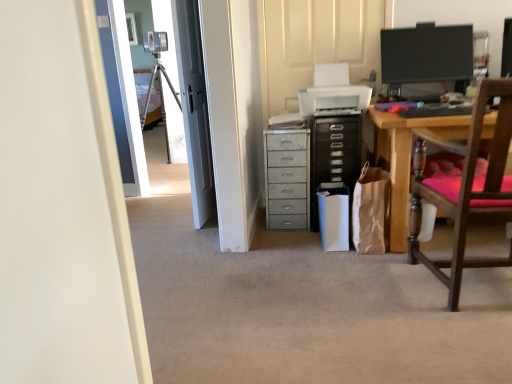
Identify the location of wooden chair with pink cushion at right. This screenshot has width=512, height=384. (465, 188).

Image resolution: width=512 pixels, height=384 pixels. Describe the element at coordinates (370, 210) in the screenshot. I see `brown paper bag at lower right` at that location.

Locate an element on the screen. black glossy monitor at upper right is located at coordinates (425, 59).

Considering the relative positions of wooden chair with pink cushion at right and metallic gray chest of drawers at center in the image provided, is wooden chair with pink cushion at right to the left or to the right of metallic gray chest of drawers at center?

wooden chair with pink cushion at right is to the right of metallic gray chest of drawers at center.

Do you think wooden chair with pink cushion at right is within metallic gray chest of drawers at center, or outside of it?

wooden chair with pink cushion at right exists outside the volume of metallic gray chest of drawers at center.

Which is in front, wooden chair with pink cushion at right or metallic gray chest of drawers at center?

wooden chair with pink cushion at right is in front.

From a real-world perspective, is wooden chair with pink cushion at right positioned under metallic gray chest of drawers at center based on gravity?

Actually, wooden chair with pink cushion at right is physically above metallic gray chest of drawers at center in the real world.

How many degrees apart are the facing directions of wooden chair with pink cushion at right and black glossy monitor at upper right?

They differ by 176 degrees in their facing directions.

Can we say wooden chair with pink cushion at right lies outside black glossy monitor at upper right?

Yes.

From the image's perspective, relative to black glossy monitor at upper right, is wooden chair with pink cushion at right above or below?

Based on their image positions, wooden chair with pink cushion at right is located beneath black glossy monitor at upper right.

Where is `chair located below the black glossy monitor at upper right (from the image's perspective)`? This screenshot has height=384, width=512. chair located below the black glossy monitor at upper right (from the image's perspective) is located at coordinates [465, 188].

Who is taller, black glossy monitor at upper right or brown paper bag at lower right?

Standing taller between the two is black glossy monitor at upper right.

In the scene shown: Considering the relative sizes of black glossy monitor at upper right and brown paper bag at lower right in the image provided, is black glossy monitor at upper right bigger than brown paper bag at lower right?

Correct, black glossy monitor at upper right is larger in size than brown paper bag at lower right.

At what (x,y) coordinates should I click in order to perform the action: click on computer monitor above the brown paper bag at lower right (from a real-world perspective). Please return your answer as a coordinate pair (x, y). This screenshot has width=512, height=384. Looking at the image, I should click on (425, 59).

Measure the distance from brown paper bag at lower right to metallic gray chest of drawers at center.

brown paper bag at lower right is 17.05 inches away from metallic gray chest of drawers at center.

Would you say metallic gray chest of drawers at center is part of brown paper bag at lower right's contents?

No, metallic gray chest of drawers at center is not inside brown paper bag at lower right.

From a real-world perspective, is brown paper bag at lower right on metallic gray chest of drawers at center?

Yes, from a real-world perspective, brown paper bag at lower right is over metallic gray chest of drawers at center

Which is nearer, [368,209] or [295,134]?

Point [368,209] is positioned closer to the camera compared to point [295,134].

Which object is positioned more to the left, brown paper bag at lower right or wooden chair with pink cushion at right?

From the viewer's perspective, brown paper bag at lower right appears more on the left side.

Considering the relative sizes of brown paper bag at lower right and wooden chair with pink cushion at right in the image provided, is brown paper bag at lower right wider than wooden chair with pink cushion at right?

Incorrect, the width of brown paper bag at lower right does not surpass that of wooden chair with pink cushion at right.

Consider the image. Choose the correct answer: Is metallic gray chest of drawers at center inside black glossy monitor at upper right or outside it?

metallic gray chest of drawers at center is outside black glossy monitor at upper right.

From the image's perspective, which one is positioned higher, metallic gray chest of drawers at center or black glossy monitor at upper right?

black glossy monitor at upper right is shown above in the image.

Is metallic gray chest of drawers at center smaller than black glossy monitor at upper right?

No, metallic gray chest of drawers at center is not smaller than black glossy monitor at upper right.

In the scene shown: Is metallic gray chest of drawers at center touching black glossy monitor at upper right?

No, metallic gray chest of drawers at center is not in contact with black glossy monitor at upper right.

Considering the sizes of objects metallic gray chest of drawers at center and wooden chair with pink cushion at right in the image provided, who is thinner, metallic gray chest of drawers at center or wooden chair with pink cushion at right?

metallic gray chest of drawers at center is thinner.

Which of these two, metallic gray chest of drawers at center or wooden chair with pink cushion at right, is smaller?

Smaller between the two is metallic gray chest of drawers at center.

Is metallic gray chest of drawers at center behind wooden chair with pink cushion at right?

Yes, metallic gray chest of drawers at center is further from the camera.

Is point (274, 177) closer or farther from the camera than point (455, 216)?

Point (274, 177) is farther from the camera than point (455, 216).

Where is `the chest of drawers located behind the wooden chair with pink cushion at right`? The height and width of the screenshot is (384, 512). the chest of drawers located behind the wooden chair with pink cushion at right is located at coordinates (287, 179).

You are a GUI agent. You are given a task and a screenshot of the screen. Output one action in this format:
    pyautogui.click(x=<x>, y=<y>)
    Task: Click on the chair located below the black glossy monitor at upper right (from the image's perspective)
    The height and width of the screenshot is (384, 512).
    Given the screenshot: What is the action you would take?
    pyautogui.click(x=465, y=188)

When comparing their distances from black glossy monitor at upper right, does metallic gray chest of drawers at center or wooden chair with pink cushion at right seem further?

The object further to black glossy monitor at upper right is wooden chair with pink cushion at right.

Estimate the real-world distances between objects in this image. Which object is further from black glossy monitor at upper right, brown paper bag at lower right or metallic gray chest of drawers at center?

metallic gray chest of drawers at center is positioned further to the anchor black glossy monitor at upper right.

Considering their positions, is brown paper bag at lower right positioned further to wooden chair with pink cushion at right than metallic gray chest of drawers at center?

metallic gray chest of drawers at center is positioned further to the anchor wooden chair with pink cushion at right.

Looking at the image, which one is located further to metallic gray chest of drawers at center, black glossy monitor at upper right or wooden chair with pink cushion at right?

Among the two, black glossy monitor at upper right is located further to metallic gray chest of drawers at center.

From the image, which object appears to be farther from brown paper bag at lower right, wooden chair with pink cushion at right or black glossy monitor at upper right?

Based on the image, black glossy monitor at upper right appears to be further to brown paper bag at lower right.

Considering their positions, is brown paper bag at lower right positioned further to black glossy monitor at upper right than wooden chair with pink cushion at right?

The object further to black glossy monitor at upper right is wooden chair with pink cushion at right.

From the image, which object appears to be nearer to black glossy monitor at upper right, metallic gray chest of drawers at center or brown paper bag at lower right?

brown paper bag at lower right.

Looking at the image, which one is located closer to wooden chair with pink cushion at right, black glossy monitor at upper right or brown paper bag at lower right?

brown paper bag at lower right is positioned closer to the anchor wooden chair with pink cushion at right.

Identify the location of shopping bag between metallic gray chest of drawers at center and black glossy monitor at upper right in the horizontal direction. This screenshot has height=384, width=512. (370, 210).

At what (x,y) coordinates should I click in order to perform the action: click on shopping bag positioned between wooden chair with pink cushion at right and metallic gray chest of drawers at center from near to far. Please return your answer as a coordinate pair (x, y). Image resolution: width=512 pixels, height=384 pixels. Looking at the image, I should click on (370, 210).

Where is `computer monitor between wooden chair with pink cushion at right and metallic gray chest of drawers at center along the z-axis`? computer monitor between wooden chair with pink cushion at right and metallic gray chest of drawers at center along the z-axis is located at coordinates (425, 59).

In order to click on shopping bag positioned between wooden chair with pink cushion at right and black glossy monitor at upper right from near to far in this screenshot , I will do `click(370, 210)`.